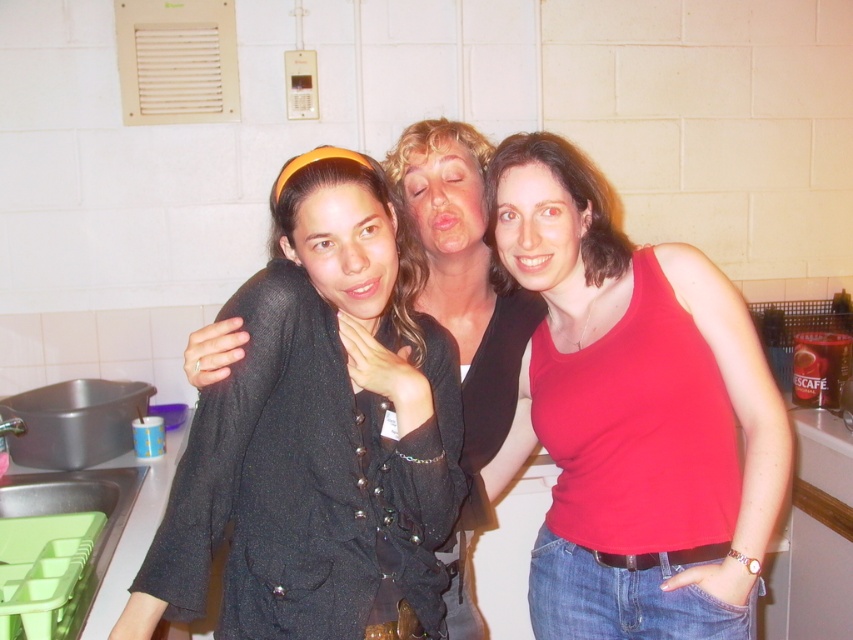
You are standing in the kitchen scene and want to reach both points. Which point, point [334,374] or point [712,349], is closer to you?

Point [334,374] is closer to the viewer than point [712,349].

You are a photographer trying to adjust the lighting for a group photo. You notice two clothing items at the center of the image, the black textured jacket at center and the red matte tank top at center. Which clothing item is shorter in height?

The black textured jacket at center has a lesser height compared to the red matte tank top at center, so the black textured jacket at center is shorter in height.